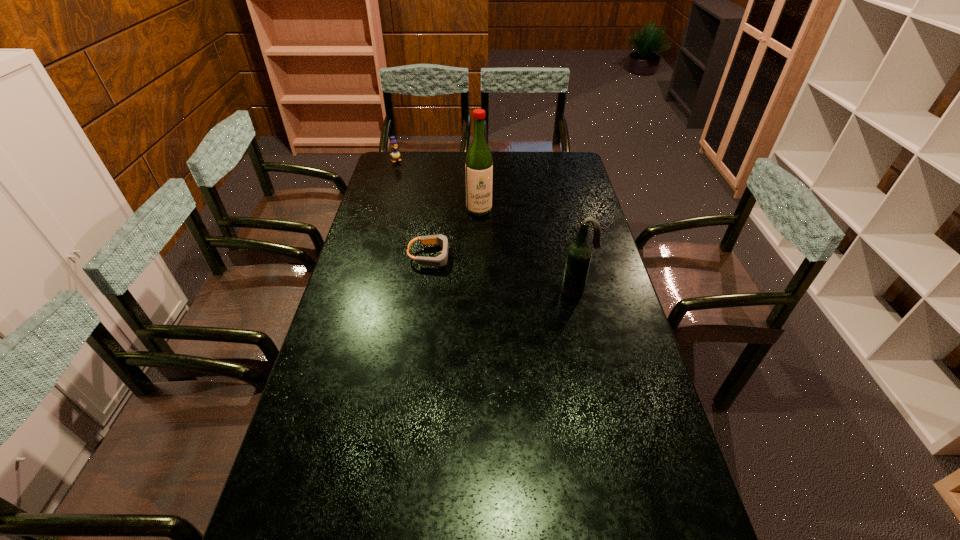
At what (x,y) coordinates should I click in order to perform the action: click on vacant region located 0.120m on the label of the second farthest object. Please return your answer as a coordinate pair (x, y). This screenshot has width=960, height=540. Looking at the image, I should click on (x=487, y=235).

Locate an element on the screen. The height and width of the screenshot is (540, 960). vacant region located 0.240m on the label of the second farthest object is located at coordinates (493, 255).

Locate an element on the screen. This screenshot has width=960, height=540. blank space located on the label of the second farthest object is located at coordinates (499, 274).

Locate an element on the screen. vacant position located on the face of the third tallest object, where the monocle is placed is located at coordinates (408, 173).

Where is `vacant space situated on the face of the third tallest object, where the monocle is placed`? Image resolution: width=960 pixels, height=540 pixels. vacant space situated on the face of the third tallest object, where the monocle is placed is located at coordinates 407,172.

At what (x,y) coordinates should I click in order to perform the action: click on blank space located 0.290m on the face of the third tallest object, where the monocle is placed. Please return your answer as a coordinate pair (x, y). Looking at the image, I should click on (424, 191).

The height and width of the screenshot is (540, 960). What are the coordinates of `object positioned at the far edge` in the screenshot? It's located at (395, 154).

Identify the location of object located at the left edge. This screenshot has width=960, height=540. [395, 154].

This screenshot has height=540, width=960. Find the location of `object that is at the right edge`. object that is at the right edge is located at coordinates (579, 253).

I want to click on object that is at the far left corner, so click(x=395, y=154).